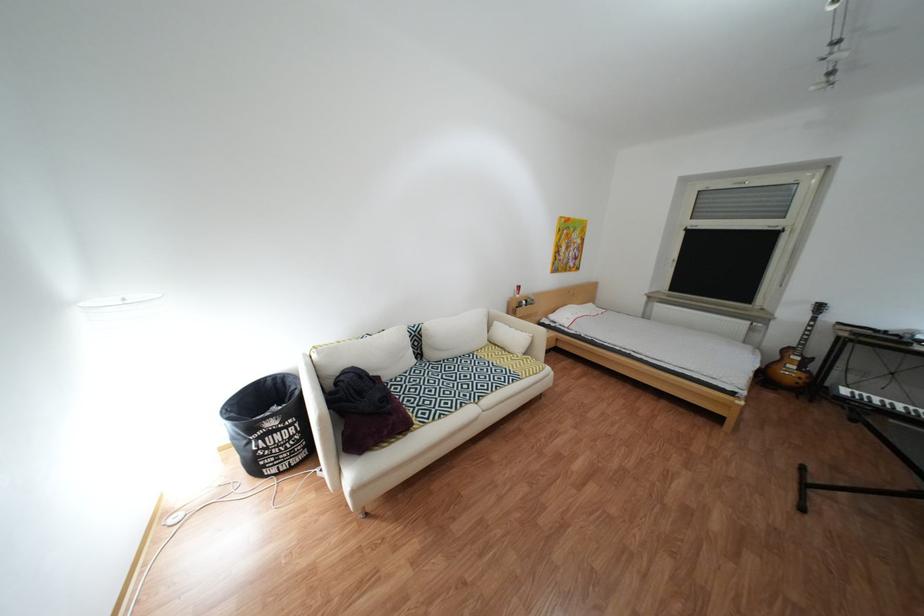
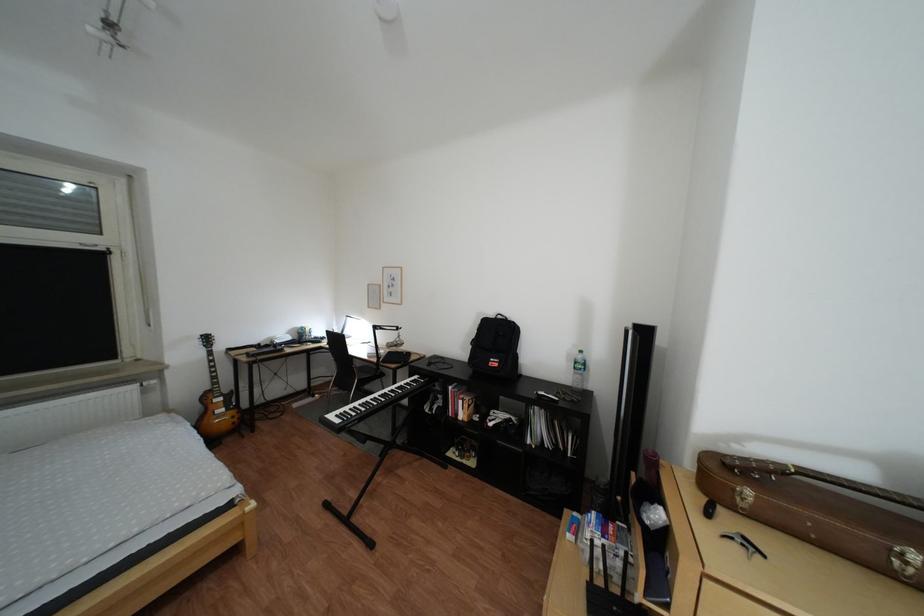
Where in the second image is the point corresponding to pixel 824 309 from the first image?

(213, 344)